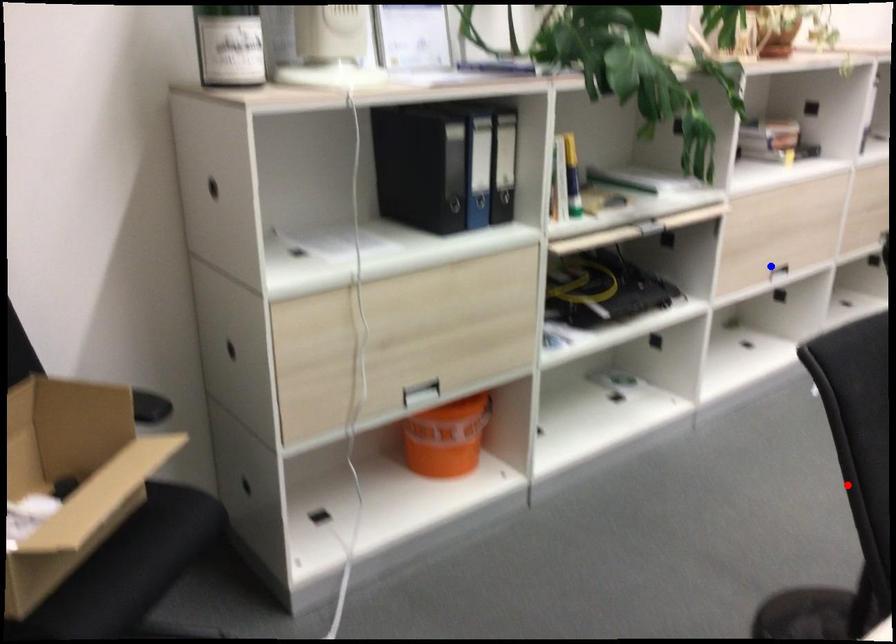
Question: Two points are marked on the image. Which point is closer to the camera?

Choices:
 (A) Blue point is closer.
 (B) Red point is closer.

Answer: (B)